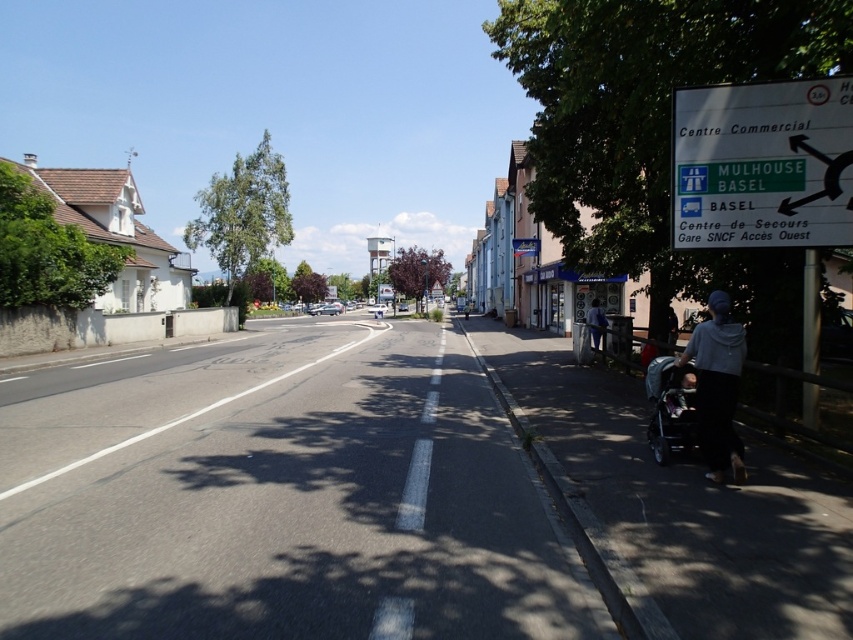
You are standing at the point with coordinates point (601, 332) and want to walk to the point with coordinates point (659, 387). According to the scene, which direction should you face to walk towards the destination?

You should face forward because point (659, 387) is in front of point (601, 332).

You are a delivery robot on the sidewalk and need to pass by the gray fabric at lower right and the dark gray fabric stroller at lower right. Which object should you move closer to avoid hitting them?

The gray fabric at lower right is on the right side of the dark gray fabric stroller at lower right, so you should move closer to the left side to avoid hitting both objects.

Based on the photo, you are a delivery person with a 1.2 meter wide cart. You need to navigate through the sidewalk between the dark gray fabric stroller at lower right and the light blue denim jacket at right. Can your cart fit through the space between them?

The dark gray fabric stroller at lower right is thinner than the light blue denim jacket at right. Since the stroller is thinner, the space between them may be sufficient for your 1.2 meter wide cart. However, without exact measurements, it is uncertain. Proceed with caution.